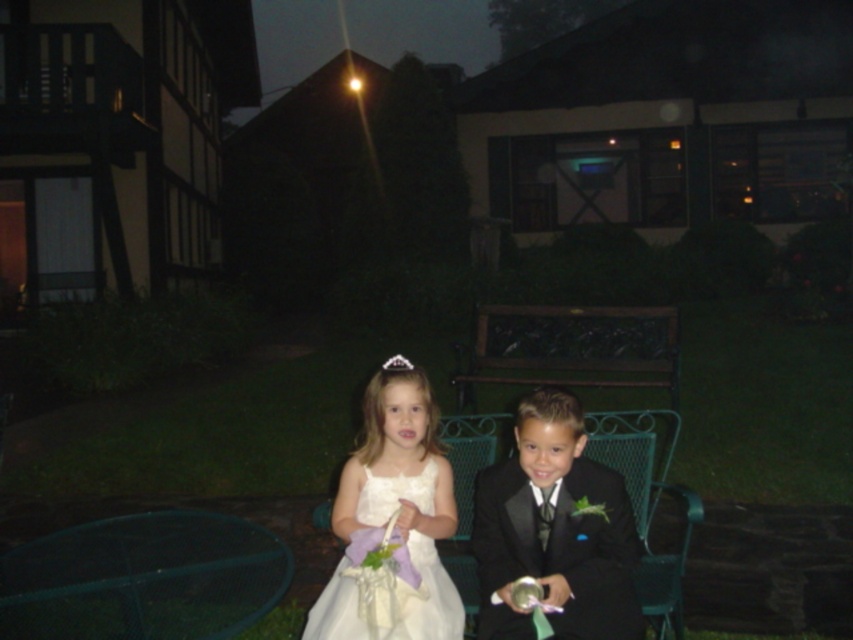
You are a photographer taking a picture of the scene. You notice a point at coordinates (554, 529) that marks a shiny black suit at center. Where should you focus your camera to capture the shiny black suit at center?

You should focus your camera at the point marked by coordinates (554, 529) to capture the shiny black suit at center.

You are a photographer trying to capture a photo of the shiny black suit at center and the white satin dress at center. Since you want to ensure both are in focus, you need to know their positions relative to each other. Which object is positioned to the right of the other?

The shiny black suit at center is to the right of the white satin dress at center.

You are a photographer at a wedding event. You need to capture a closeup shot of the shiny black suit at center. The camera you are using has a minimum focusing distance of 3 meters. Can you take the photo without moving closer?

The shiny black suit at center is 2.89 meters away from camera. Since the minimum focusing distance is 3 meters, the camera cannot focus on the shiny black suit at center from this distance. You need to move back or use a different lens.